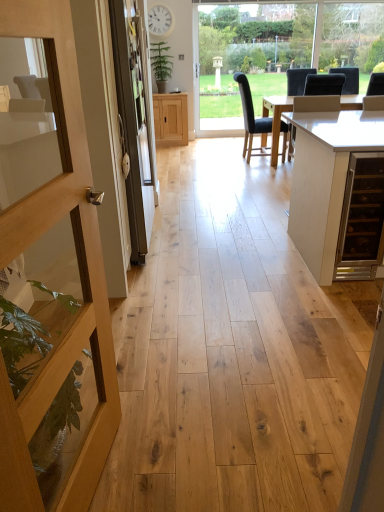
Question: From a real-world perspective, relative to light brown wood cabinet at center, is green leafy plant at upper center vertically above or below?

Choices:
 (A) above
 (B) below

Answer: (A)

Question: Considering the positions of green leafy plant at upper center and light brown wood cabinet at center in the image, is green leafy plant at upper center taller or shorter than light brown wood cabinet at center?

Choices:
 (A) tall
 (B) short

Answer: (B)

Question: Estimate the real-world distances between objects in this image. Which object is closer to the white glossy table at center?

Choices:
 (A) wooden door at left
 (B) light brown wood cabinet at center
 (C) transparent glass window at center
 (D) clear glass screen door at left
 (E) dark gray fabric chair at center, placed as the second chair when sorted from left to right

Answer: (D)

Question: Based on their relative distances, which object is farther from the transparent glass window at center?

Choices:
 (A) white glossy table at center
 (B) clear glass screen door at left
 (C) light brown wood cabinet at center
 (D) black leather chair at center, the first chair viewed from the left
 (E) green leafy plant at upper center

Answer: (B)